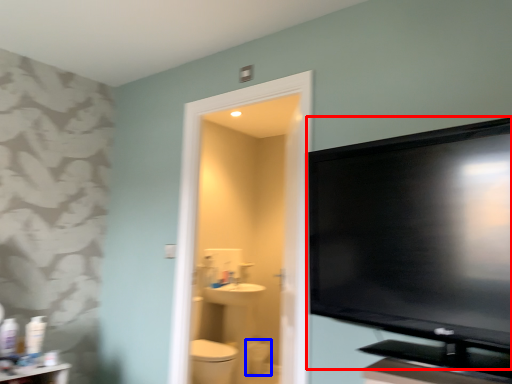
Question: Which object appears closest to the camera in this image, television (highlighted by a red box) or toilet bowl (highlighted by a blue box)?

Choices:
 (A) television
 (B) toilet bowl

Answer: (A)